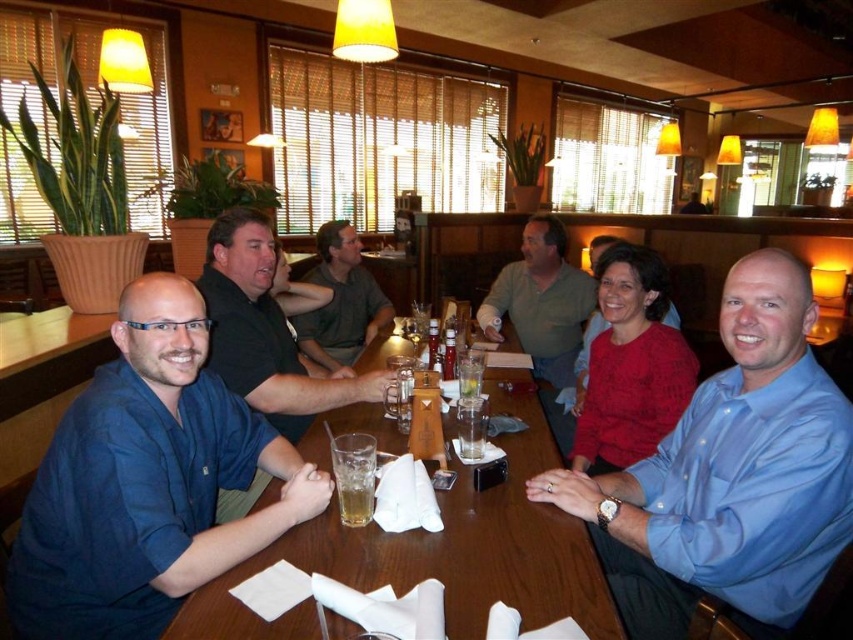
Question: Which of the following is the farthest from the observer?

Choices:
 (A) green fabric shirt at center
 (B) green cotton shirt at center

Answer: (A)

Question: Which of these objects is positioned closest to the green fabric shirt at center?

Choices:
 (A) blue button-down shirt at center
 (B) wooden table at center
 (C) green cotton shirt at center

Answer: (C)

Question: Which point is farther to the camera?

Choices:
 (A) (524, 304)
 (B) (140, 627)

Answer: (A)

Question: Can you confirm if blue shirt at left is positioned to the right of green fabric shirt at center?

Choices:
 (A) yes
 (B) no

Answer: (B)

Question: Does green fabric shirt at center appear under translucent glass beer at table center?

Choices:
 (A) yes
 (B) no

Answer: (B)

Question: Is blue button-down shirt at center to the left of green cotton shirt at center from the viewer's perspective?

Choices:
 (A) yes
 (B) no

Answer: (B)